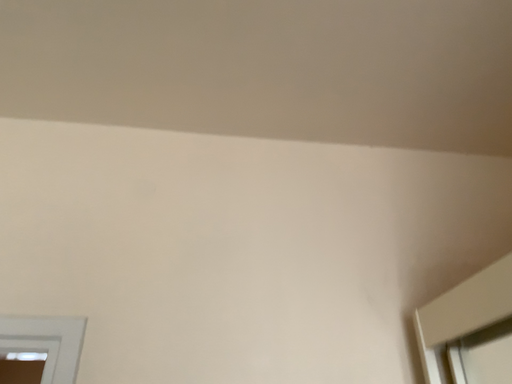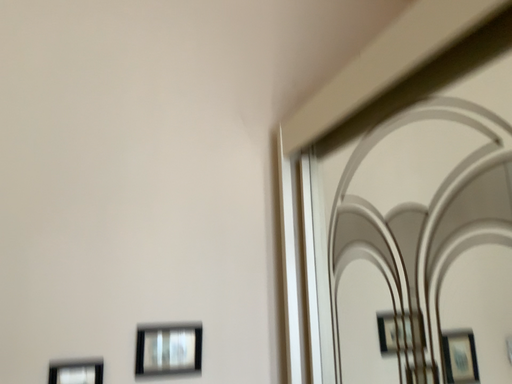
Question: Which way did the camera rotate in the video?

Choices:
 (A) rotated left
 (B) rotated right

Answer: (B)